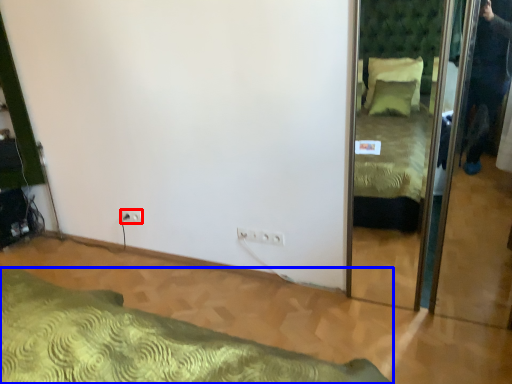
Question: Which object is closer to the camera taking this photo, electric outlet (highlighted by a red box) or bed (highlighted by a blue box)?

Choices:
 (A) electric outlet
 (B) bed

Answer: (B)